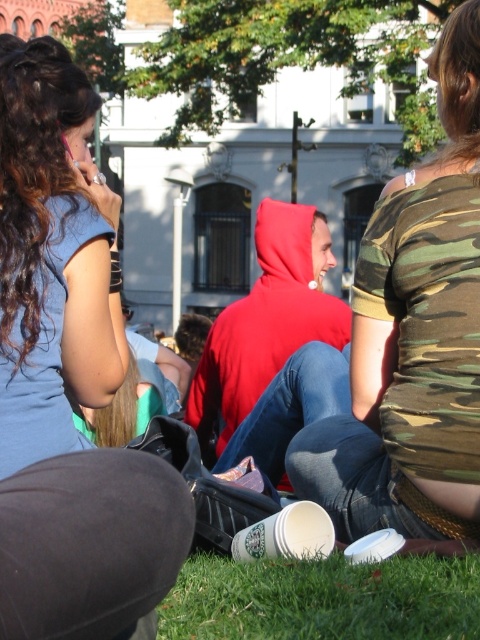
Question: Can you confirm if matte blue shirt at upper left is positioned to the right of camouflage fabric shirt at center?

Choices:
 (A) yes
 (B) no

Answer: (B)

Question: In this image, where is matte blue shirt at upper left located relative to green grass at lower center?

Choices:
 (A) below
 (B) above

Answer: (B)

Question: Among these objects, which one is nearest to the camera?

Choices:
 (A) green grass at lower center
 (B) camouflage fabric shirt at center

Answer: (A)

Question: Estimate the real-world distances between objects in this image. Which object is closer to the camouflage fabric shirt at center?

Choices:
 (A) green grass at lower center
 (B) matte blue shirt at upper left

Answer: (A)

Question: Which point appears farthest from the camera in this image?

Choices:
 (A) (48, 616)
 (B) (439, 620)
 (C) (404, 344)

Answer: (C)

Question: Is matte blue shirt at upper left to the right of camouflage fabric shirt at center from the viewer's perspective?

Choices:
 (A) no
 (B) yes

Answer: (A)